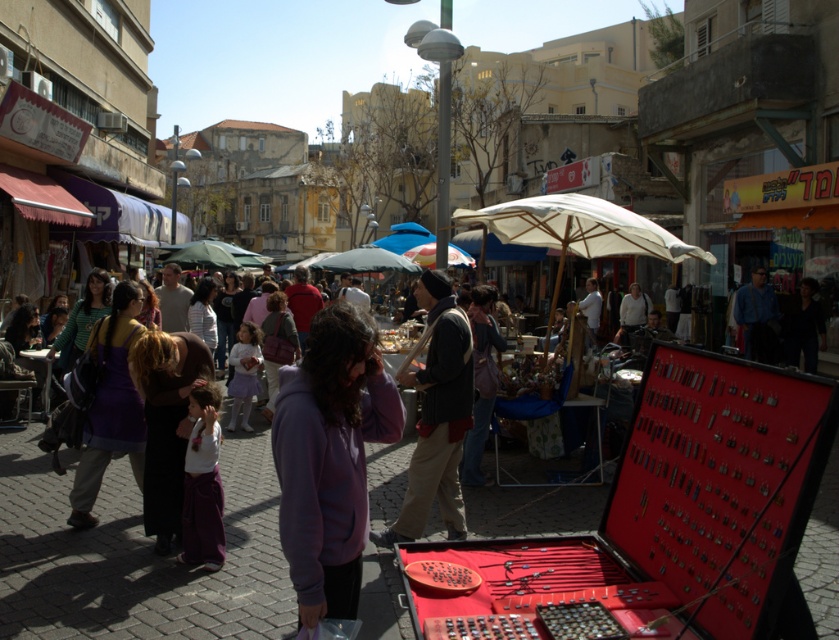
You are a customer at this market and want to decide which item to pick up first. The knitted wool scarf at center and the white fabric umbrella at center are both in your view. Which one is shorter in height?

The knitted wool scarf at center is not as tall as the white fabric umbrella at center, so the knitted wool scarf at center is shorter.

You are standing at the entrance of the market and want to locate the purple fleece jacket at center. According to the coordinates provided, in which direction should you walk to reach it?

The purple fleece jacket at center is located at coordinates point (331, 458). Since the coordinate system typically has (0, 0) at the bottom left corner, the jacket is positioned to the right and slightly above the center point, so you should walk towards the right and slightly forward from the entrance to reach it.

Looking at this image, you are a customer at the market and want to buy both the purple fleece jacket at center and the knitted wool scarf at center. However, you notice that one of them is covering part of the other. Which item is on top?

The purple fleece jacket at center is positioned over knitted wool scarf at center, so the jacket is on top.